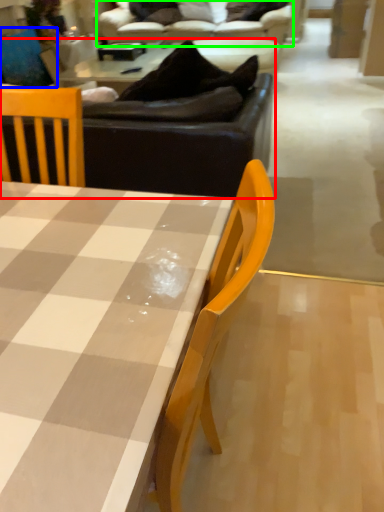
Question: Estimate the real-world distances between objects in this image. Which object is farther from studio couch (highlighted by a red box), swivel chair (highlighted by a blue box) or studio couch (highlighted by a green box)?

Choices:
 (A) swivel chair
 (B) studio couch

Answer: (A)